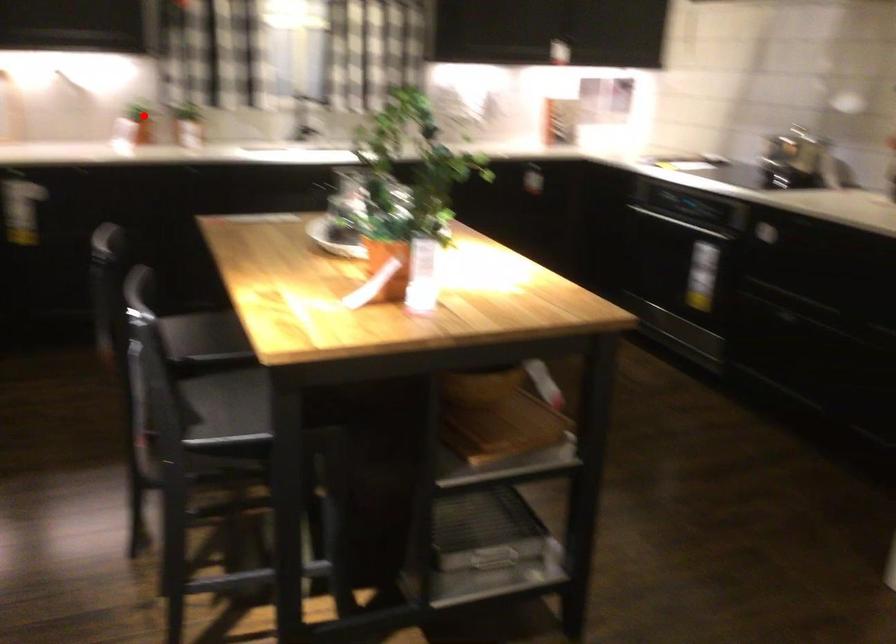
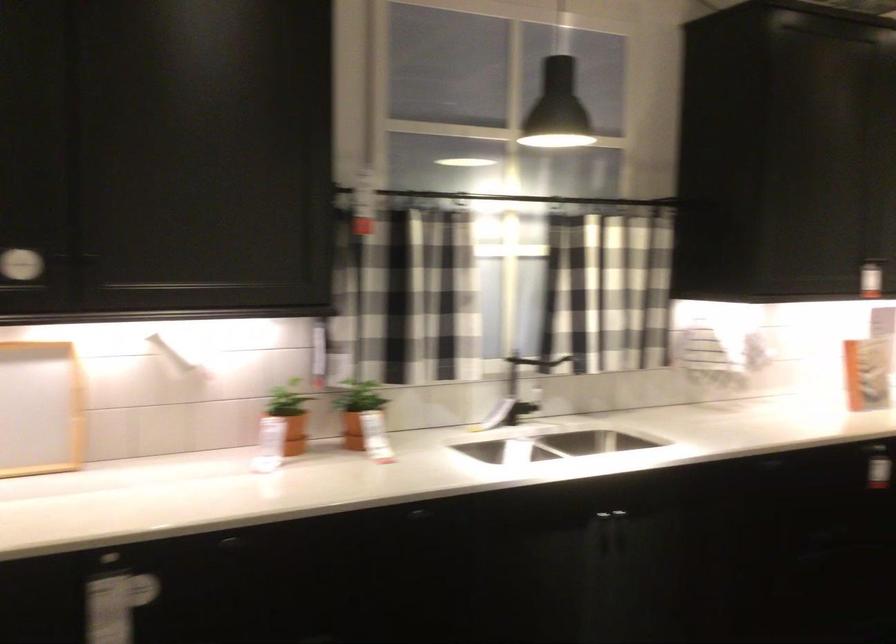
Question: I am providing you with two images of the same scene from different viewpoints. Given a red point in image1, look at the same physical point in image2. Is it:

Choices:
 (A) Closer to the viewpoint
 (B) Farther from the viewpoint

Answer: (A)